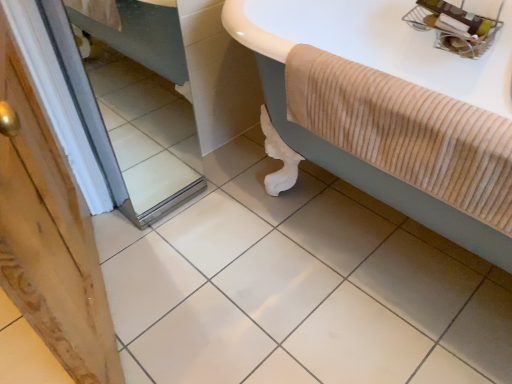
Image resolution: width=512 pixels, height=384 pixels. What are the coordinates of `vacant area on top of white glossy ceramic tile at center (from a real-world perspective)` in the screenshot? It's located at (278, 270).